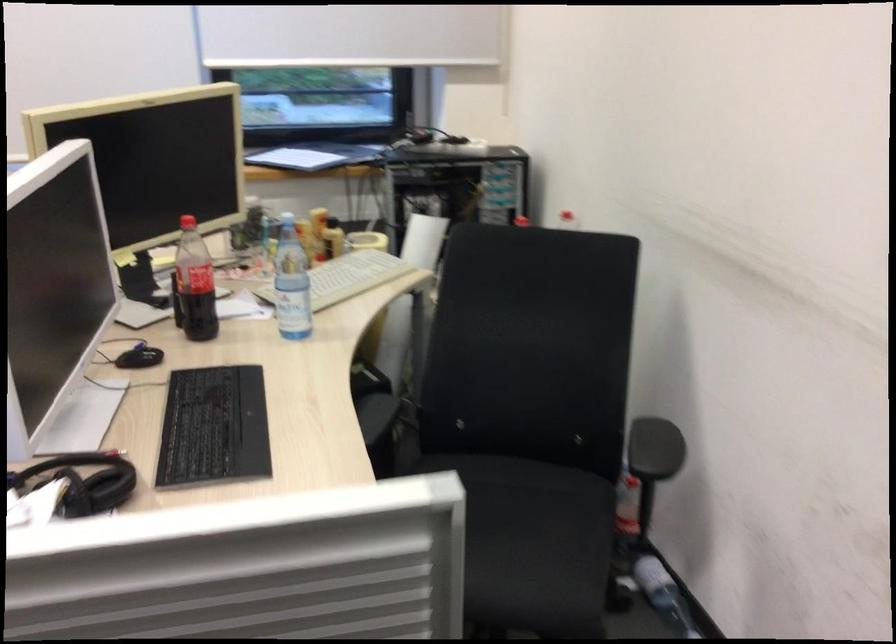
The location [347,277] corresponds to which object?

It corresponds to the beige keyboard in the image.